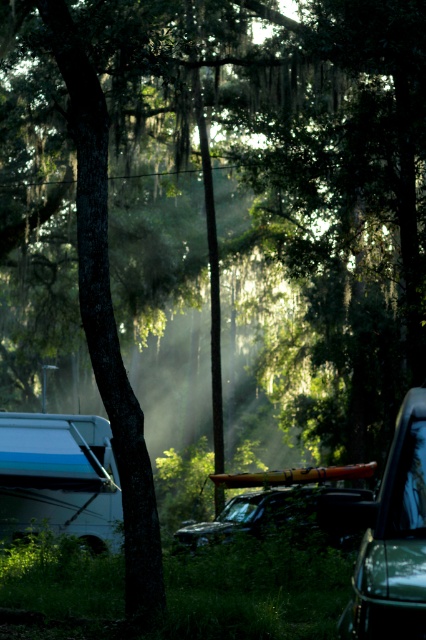
Based on the photo, you are planning to drive a car through the path between the blue metallic camper at lower left and the shiny black suv at center. Is there enough space for your car to pass through?

The blue metallic camper at lower left is to the left of shiny black suv at center, so there is space between them for a car to pass through.

You are standing at the center of the scene and want to move towards the blue metallic camper at lower left. Based on its 2D coordinates, in which general direction should you walk? Choose from north, south, east, or west?

The blue metallic camper at lower left is located at coordinates point (58,476). Since the coordinate system typically places the origin at the bottom left corner, the camper is positioned towards the lower left part of the scene. Therefore, you should walk west and north to reach it.

You are standing in the wooded area and want to take a photo of both the point at coordinates point (45,483) and the point at coordinates point (267,508). Which point should you focus on first to ensure both are in focus?

You should focus on the point at coordinates point (45,483) first because it is closer to you than the point at coordinates point (267,508). This ensures both points will be in focus as you adjust the camera.